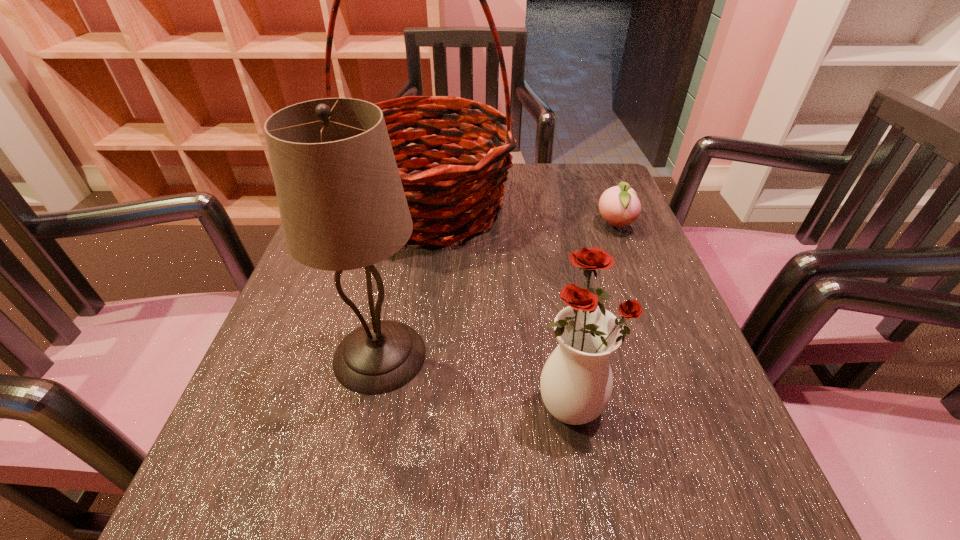
The height and width of the screenshot is (540, 960). I want to click on basket present at the left edge, so click(x=453, y=186).

I want to click on lampshade present at the left edge, so click(x=342, y=205).

Locate an element on the screen. The image size is (960, 540). object present at the right edge is located at coordinates (619, 206).

Locate an element on the screen. The height and width of the screenshot is (540, 960). object located at the far left corner is located at coordinates pos(453,186).

In the image, there is a desktop. At what (x,y) coordinates should I click in order to perform the action: click on vacant space at the far edge. Please return your answer as a coordinate pair (x, y). Image resolution: width=960 pixels, height=540 pixels. Looking at the image, I should click on (535, 173).

I want to click on free location at the left edge of the desktop, so coord(280,407).

At what (x,y) coordinates should I click in order to perform the action: click on vacant area at the right edge of the desktop. Please return your answer as a coordinate pair (x, y). This screenshot has height=540, width=960. Looking at the image, I should click on (722, 447).

You are a GUI agent. You are given a task and a screenshot of the screen. Output one action in this format:
    pyautogui.click(x=<x>, y=<y>)
    Task: Click on the free space at the near left corner of the desktop
    Image resolution: width=960 pixels, height=540 pixels.
    Given the screenshot: What is the action you would take?
    pyautogui.click(x=238, y=511)

In the image, there is a desktop. Where is `vacant space at the far right corner`? Image resolution: width=960 pixels, height=540 pixels. vacant space at the far right corner is located at coordinates (586, 184).

The height and width of the screenshot is (540, 960). In the image, there is a desktop. In order to click on free space at the near right corner in this screenshot , I will do `click(737, 531)`.